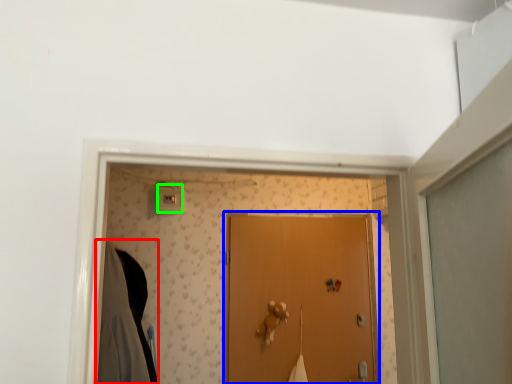
Question: Which is nearer to the robe (highlighted by a red box)? door (highlighted by a blue box) or light switch (highlighted by a green box).

Choices:
 (A) door
 (B) light switch

Answer: (B)